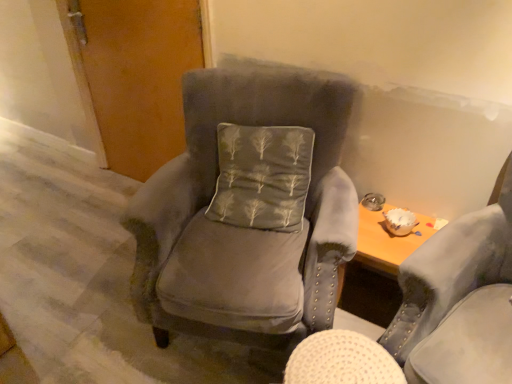
In order to face satin gray pillow at center, should I rotate leftwards or rightwards?

Rotate right and turn 0.625 degrees.

This screenshot has height=384, width=512. What do you see at coordinates (435, 313) in the screenshot?
I see `velvet gray armchair at center, which ranks as the 1th chair in right-to-left order` at bounding box center [435, 313].

You are a GUI agent. You are given a task and a screenshot of the screen. Output one action in this format:
    pyautogui.click(x=<x>, y=<y>)
    Task: Click on the satin gray pillow at center
    
    Given the screenshot: What is the action you would take?
    pyautogui.click(x=262, y=176)

From a real-world perspective, is velvet gray chair at center, which appears as the 1th chair when viewed from the left, physically above velvet gray armchair at center, which ranks as the 1th chair in right-to-left order?

Yes.

Would you say velvet gray chair at center, the 2th chair from the right, is inside or outside velvet gray armchair at center, the 2th chair positioned from the left?

velvet gray chair at center, the 2th chair from the right, is not inside velvet gray armchair at center, the 2th chair positioned from the left, it's outside.

How different are the orientations of velvet gray chair at center, the 2th chair from the right, and velvet gray armchair at center, the 2th chair positioned from the left, in degrees?

They differ by 38.6 degrees in their facing directions.

In order to click on chair below the velvet gray chair at center, which appears as the 1th chair when viewed from the left (from a real-world perspective) in this screenshot , I will do `click(435, 313)`.

You are a GUI agent. You are given a task and a screenshot of the screen. Output one action in this format:
    pyautogui.click(x=<x>, y=<y>)
    Task: Click on the chair on the right of velvet gray chair at center, the 2th chair from the right
    Image resolution: width=512 pixels, height=384 pixels.
    Given the screenshot: What is the action you would take?
    pyautogui.click(x=435, y=313)

Between velvet gray armchair at center, which ranks as the 1th chair in right-to-left order, and velvet gray chair at center, the 2th chair from the right, which one has larger size?

velvet gray chair at center, the 2th chair from the right.

Is there a large distance between velvet gray armchair at center, which ranks as the 1th chair in right-to-left order, and velvet gray chair at center, the 2th chair from the right?

velvet gray armchair at center, which ranks as the 1th chair in right-to-left order, is near velvet gray chair at center, the 2th chair from the right, not far away.

Is velvet gray armchair at center, the 2th chair positioned from the left, surrounded by satin gray pillow at center?

No, velvet gray armchair at center, the 2th chair positioned from the left, is located outside of satin gray pillow at center.

Is satin gray pillow at center oriented towards velvet gray armchair at center, the 2th chair positioned from the left?

No, satin gray pillow at center is not oriented towards velvet gray armchair at center, the 2th chair positioned from the left.

Can you confirm if satin gray pillow at center is bigger than velvet gray armchair at center, the 2th chair positioned from the left?

No, satin gray pillow at center is not bigger than velvet gray armchair at center, the 2th chair positioned from the left.

Which object is more forward, satin gray pillow at center or velvet gray armchair at center, which ranks as the 1th chair in right-to-left order?

velvet gray armchair at center, which ranks as the 1th chair in right-to-left order, is closer to the camera.

Is there a large distance between satin gray pillow at center and matte wood door at upper left?

No, satin gray pillow at center is in close proximity to matte wood door at upper left.

Is satin gray pillow at center taller or shorter than matte wood door at upper left?

Clearly, satin gray pillow at center is shorter compared to matte wood door at upper left.

Identify the location of pillow above the matte wood door at upper left (from a real-world perspective). (262, 176).

Is velvet gray chair at center, the 2th chair from the right, facing away from matte wood door at upper left?

No, velvet gray chair at center, the 2th chair from the right, is not facing away from matte wood door at upper left.

From the picture: How different are the orientations of velvet gray chair at center, which appears as the 1th chair when viewed from the left, and matte wood door at upper left in degrees?

The angle between the facing direction of velvet gray chair at center, which appears as the 1th chair when viewed from the left, and the facing direction of matte wood door at upper left is 20.8 degrees.

From the picture: Is velvet gray chair at center, the 2th chair from the right, spatially inside matte wood door at upper left, or outside of it?

velvet gray chair at center, the 2th chair from the right, is located beyond the bounds of matte wood door at upper left.

Considering the relative sizes of velvet gray chair at center, which appears as the 1th chair when viewed from the left, and matte wood door at upper left in the image provided, is velvet gray chair at center, which appears as the 1th chair when viewed from the left, wider than matte wood door at upper left?

Correct, the width of velvet gray chair at center, which appears as the 1th chair when viewed from the left, exceeds that of matte wood door at upper left.

Could velvet gray chair at center, the 2th chair from the right, be considered to be inside matte wood door at upper left?

No.

Between matte wood door at upper left and velvet gray chair at center, the 2th chair from the right, which one appears on the right side from the viewer's perspective?

velvet gray chair at center, the 2th chair from the right, is more to the right.

Is matte wood door at upper left oriented away from velvet gray chair at center, which appears as the 1th chair when viewed from the left?

matte wood door at upper left does not have its back to velvet gray chair at center, which appears as the 1th chair when viewed from the left.

Based on the photo, in terms of height, does matte wood door at upper left look taller or shorter compared to velvet gray chair at center, which appears as the 1th chair when viewed from the left?

Considering their sizes, matte wood door at upper left has more height than velvet gray chair at center, which appears as the 1th chair when viewed from the left.

From a real-world perspective, is velvet gray armchair at center, which ranks as the 1th chair in right-to-left order, above or below matte wood door at upper left?

velvet gray armchair at center, which ranks as the 1th chair in right-to-left order, is below matte wood door at upper left.

Does velvet gray armchair at center, the 2th chair positioned from the left, contain matte wood door at upper left?

Definitely not — matte wood door at upper left is not inside velvet gray armchair at center, the 2th chair positioned from the left.

Is point (359, 363) in front of point (149, 10)?

Yes, it is in front of point (149, 10).

Locate an element on the screen. The width and height of the screenshot is (512, 384). chair above the velvet gray armchair at center, which ranks as the 1th chair in right-to-left order (from a real-world perspective) is located at coordinates (248, 212).

This screenshot has height=384, width=512. Identify the location of chair located on the left of velvet gray armchair at center, which ranks as the 1th chair in right-to-left order. (248, 212).

When comparing their distances from velvet gray armchair at center, which ranks as the 1th chair in right-to-left order, does satin gray pillow at center or matte wood door at upper left seem closer?

Based on the image, satin gray pillow at center appears to be nearer to velvet gray armchair at center, which ranks as the 1th chair in right-to-left order.

Considering their positions, is satin gray pillow at center positioned further to matte wood door at upper left than velvet gray chair at center, which appears as the 1th chair when viewed from the left?

satin gray pillow at center lies further to matte wood door at upper left than the other object.

Which object lies further to the anchor point matte wood door at upper left, satin gray pillow at center or velvet gray armchair at center, which ranks as the 1th chair in right-to-left order?

velvet gray armchair at center, which ranks as the 1th chair in right-to-left order.

Considering their positions, is velvet gray chair at center, the 2th chair from the right, positioned further to matte wood door at upper left than velvet gray armchair at center, the 2th chair positioned from the left?

velvet gray armchair at center, the 2th chair positioned from the left.

Consider the image. From the image, which object appears to be nearer to velvet gray armchair at center, which ranks as the 1th chair in right-to-left order, satin gray pillow at center or velvet gray chair at center, which appears as the 1th chair when viewed from the left?

Among the two, velvet gray chair at center, which appears as the 1th chair when viewed from the left, is located nearer to velvet gray armchair at center, which ranks as the 1th chair in right-to-left order.

Considering their positions, is velvet gray armchair at center, which ranks as the 1th chair in right-to-left order, positioned further to velvet gray chair at center, which appears as the 1th chair when viewed from the left, than satin gray pillow at center?

velvet gray armchair at center, which ranks as the 1th chair in right-to-left order, is further to velvet gray chair at center, which appears as the 1th chair when viewed from the left.

Estimate the real-world distances between objects in this image. Which object is closer to satin gray pillow at center, matte wood door at upper left or velvet gray chair at center, which appears as the 1th chair when viewed from the left?

Among the two, velvet gray chair at center, which appears as the 1th chair when viewed from the left, is located nearer to satin gray pillow at center.

Which object lies nearer to the anchor point velvet gray chair at center, which appears as the 1th chair when viewed from the left, velvet gray armchair at center, the 2th chair positioned from the left, or matte wood door at upper left?

Among the two, velvet gray armchair at center, the 2th chair positioned from the left, is located nearer to velvet gray chair at center, which appears as the 1th chair when viewed from the left.

Identify the location of pillow between velvet gray chair at center, which appears as the 1th chair when viewed from the left, and matte wood door at upper left, along the z-axis. This screenshot has width=512, height=384. (262, 176).

This screenshot has width=512, height=384. Identify the location of chair located between matte wood door at upper left and velvet gray armchair at center, which ranks as the 1th chair in right-to-left order, in the left-right direction. (248, 212).

Locate an element on the screen. This screenshot has height=384, width=512. pillow between velvet gray chair at center, the 2th chair from the right, and velvet gray armchair at center, which ranks as the 1th chair in right-to-left order is located at coordinates (262, 176).

Identify the location of pillow situated between matte wood door at upper left and velvet gray armchair at center, which ranks as the 1th chair in right-to-left order, from left to right. (262, 176).